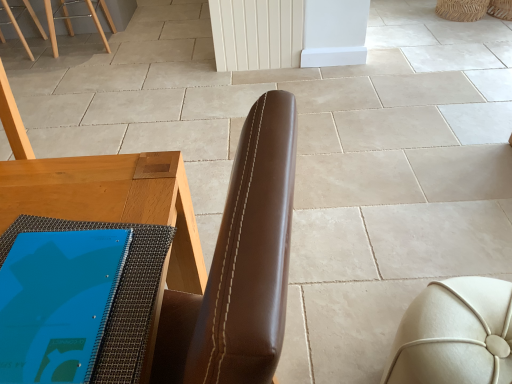
Question: From a real-world perspective, relative to white leather ottoman at lower right, is brown leather chair at center vertically above or below?

Choices:
 (A) above
 (B) below

Answer: (A)

Question: Considering the positions of brown leather chair at center and white leather ottoman at lower right in the image, is brown leather chair at center wider or thinner than white leather ottoman at lower right?

Choices:
 (A) wide
 (B) thin

Answer: (A)

Question: In terms of size, does brown leather chair at center appear bigger or smaller than white leather ottoman at lower right?

Choices:
 (A) big
 (B) small

Answer: (A)

Question: From a real-world perspective, is white leather ottoman at lower right above or below brown leather chair at center?

Choices:
 (A) below
 (B) above

Answer: (A)

Question: In the image, is white leather ottoman at lower right on the left side or the right side of brown leather chair at center?

Choices:
 (A) left
 (B) right

Answer: (B)

Question: Does point (510, 289) appear closer or farther from the camera than point (276, 311)?

Choices:
 (A) farther
 (B) closer

Answer: (A)

Question: Relative to brown leather chair at center, is white leather ottoman at lower right in front or behind?

Choices:
 (A) front
 (B) behind

Answer: (B)